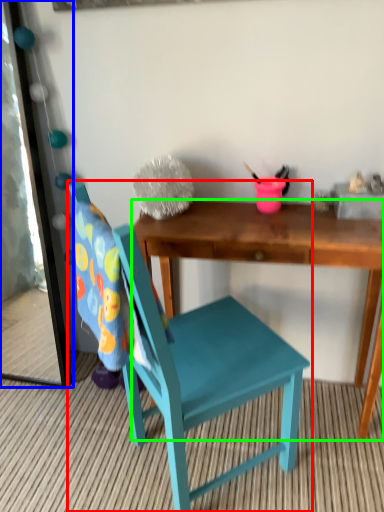
Question: Which object is positioned closest to chair (highlighted by a red box)? Select from mirror (highlighted by a blue box) and desk (highlighted by a green box).

Choices:
 (A) mirror
 (B) desk

Answer: (B)